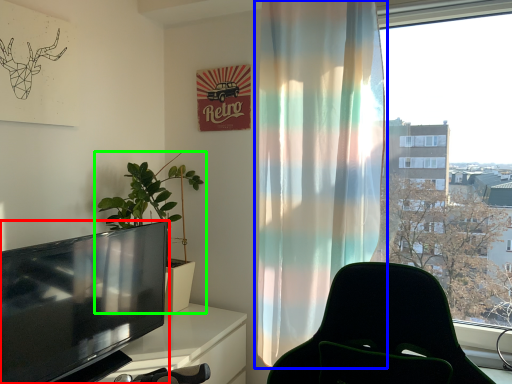
Question: Estimate the real-world distances between objects in this image. Which object is farther from television (highlighted by a red box), curtain (highlighted by a blue box) or houseplant (highlighted by a green box)?

Choices:
 (A) curtain
 (B) houseplant

Answer: (A)